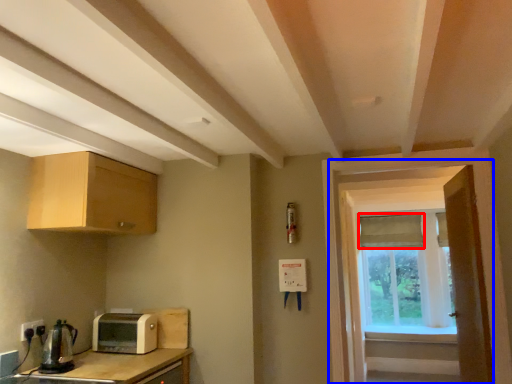
Question: Which object is further to the camera taking this photo, curtain (highlighted by a red box) or screen door (highlighted by a blue box)?

Choices:
 (A) curtain
 (B) screen door

Answer: (A)